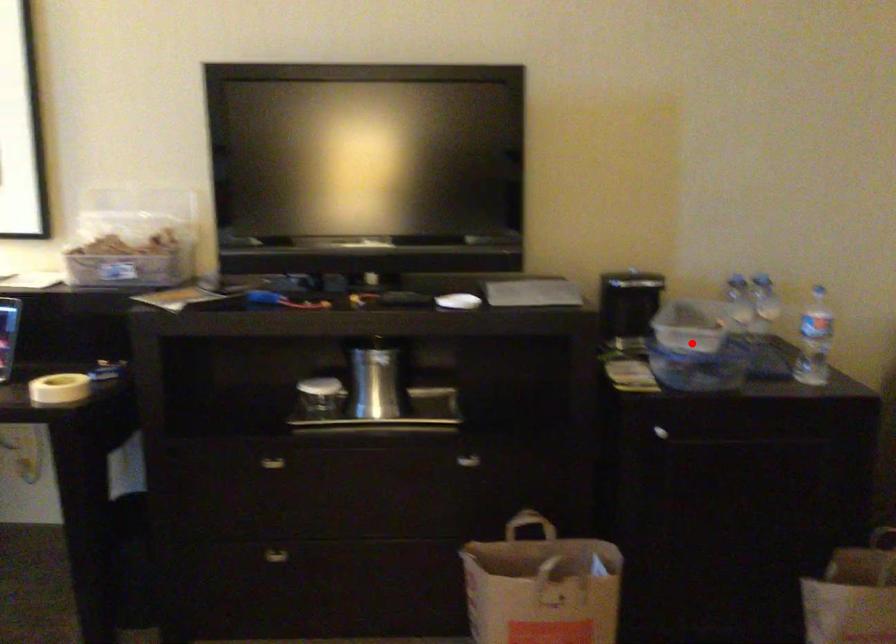
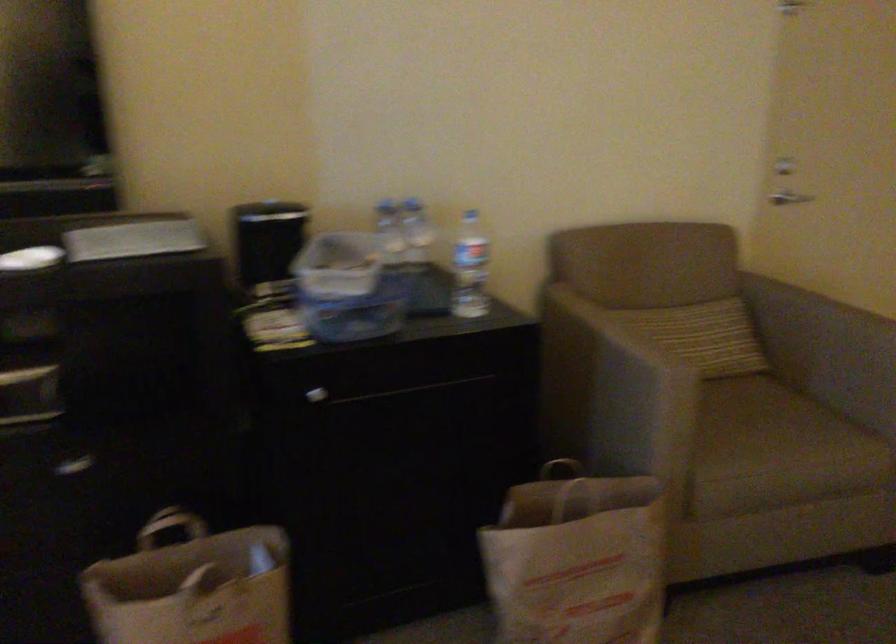
Where in the second image is the point corresponding to the highlighted location from the first image?

(348, 288)